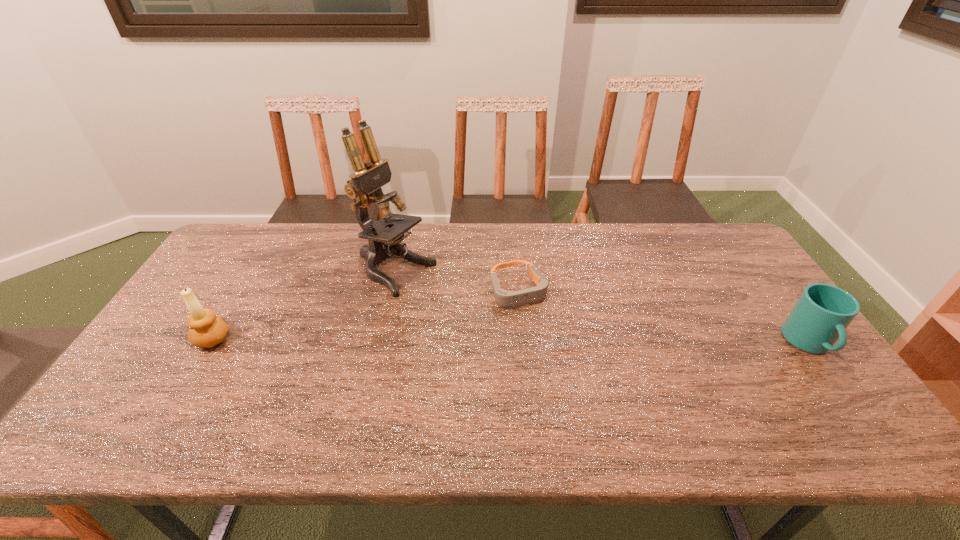
The height and width of the screenshot is (540, 960). In order to click on vacant space on the desktop that is between the candle_holder and the cup and is positioned on the front and back of the second object from right to left in this screenshot , I will do `click(546, 341)`.

Where is `vacant spot on the desktop that is between the third shortest object and the cup and is positioned at the eyepieces of the second object from left to right`? The height and width of the screenshot is (540, 960). vacant spot on the desktop that is between the third shortest object and the cup and is positioned at the eyepieces of the second object from left to right is located at coordinates (535, 341).